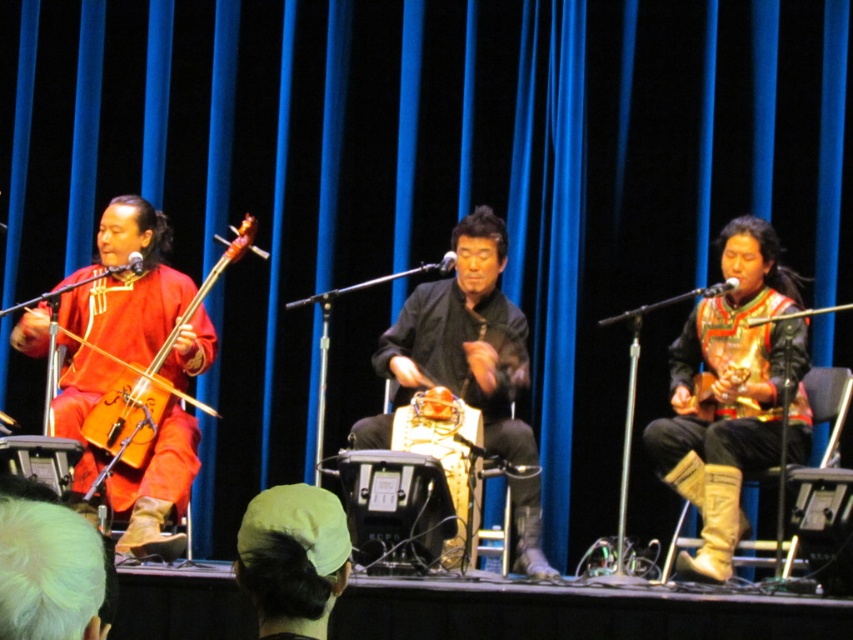
Question: Is gold leather boots at right positioned behind matte wood violin at left?

Choices:
 (A) no
 (B) yes

Answer: (B)

Question: Which object appears closest to the camera in this image?

Choices:
 (A) matte red fabric at left
 (B) matte wood violin at left

Answer: (A)

Question: Does gold leather boots at right have a greater width compared to white hair at lower left?

Choices:
 (A) yes
 (B) no

Answer: (A)

Question: Does matte red fabric at left have a greater width compared to white hair at lower left?

Choices:
 (A) no
 (B) yes

Answer: (B)

Question: Which of the following is the farthest from the observer?

Choices:
 (A) (258, 500)
 (B) (473, 278)
 (C) (689, 410)
 (D) (70, 394)

Answer: (B)

Question: Among these points, which one is farthest from the camera?

Choices:
 (A) (306, 504)
 (B) (12, 634)
 (C) (712, 419)
 (D) (152, 250)

Answer: (D)